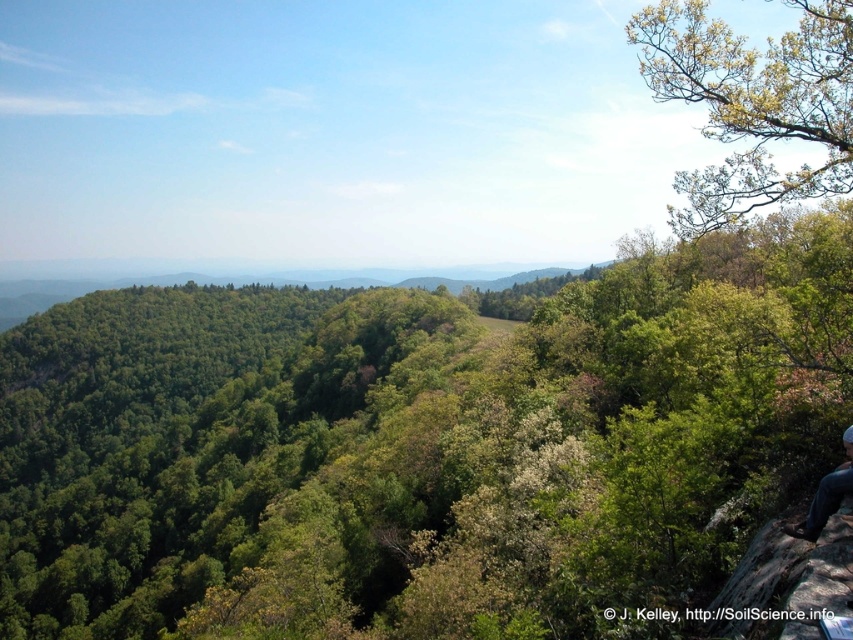
You are a hiker who wants to take a photo of the blue jeans at lower right and the green leafy tree at upper center. Which object should you focus on first if you want both to be in sharp focus?

The green leafy tree at upper center is larger than the blue jeans at lower right, so you should focus on the green leafy tree at upper center first to ensure both are in sharp focus.